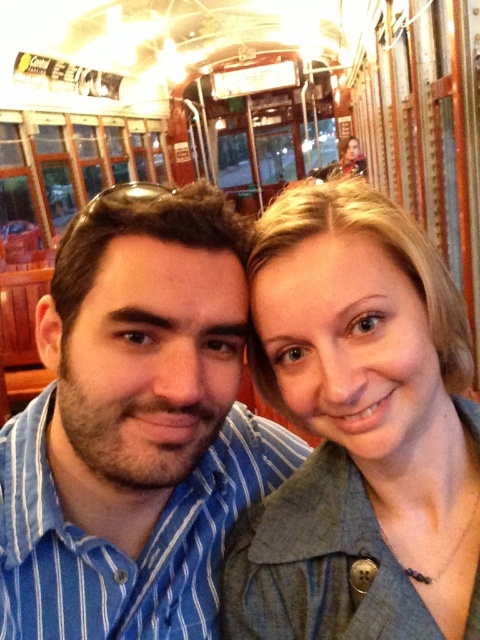
You are a photographer trying to capture a candid shot of both the blue striped shirt at center and the green textured jacket at center. Since you can only focus on one subject at a time, which one should you aim for first to ensure the other is still in frame?

You should focus on the blue striped shirt at center first because it is positioned to the left of the green textured jacket at center, so capturing it first keeps the green textured jacket at center within the frame as you adjust your shot.

Consider the image. You are a photographer standing outside the tram with a camera that has a 5 inch wide lens. You want to take a photo of both the blue striped shirt at center and the green textured jacket at center. Can your lens capture both subjects in the same frame?

The blue striped shirt at center and green textured jacket at center are 5.19 inches apart from each other. Since your lens is 5 inches wide, it is slightly narrower than the distance between them, so you might need to adjust your position or zoom out to ensure both fit within the frame.

You are a passenger in the tram and want to touch the point at coordinates (134, 428). Which object will your finger touch?

The point at coordinates (134, 428) is on the blue striped shirt at center, so your finger will touch the blue striped shirt at center.